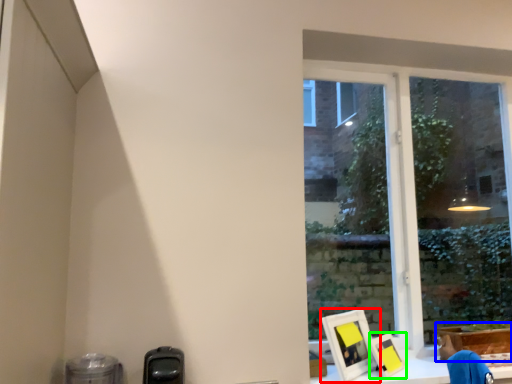
Question: Which is farther away from picture frame (highlighted by a red box)? cardboard box (highlighted by a blue box) or picture frame (highlighted by a green box)?

Choices:
 (A) cardboard box
 (B) picture frame

Answer: (A)